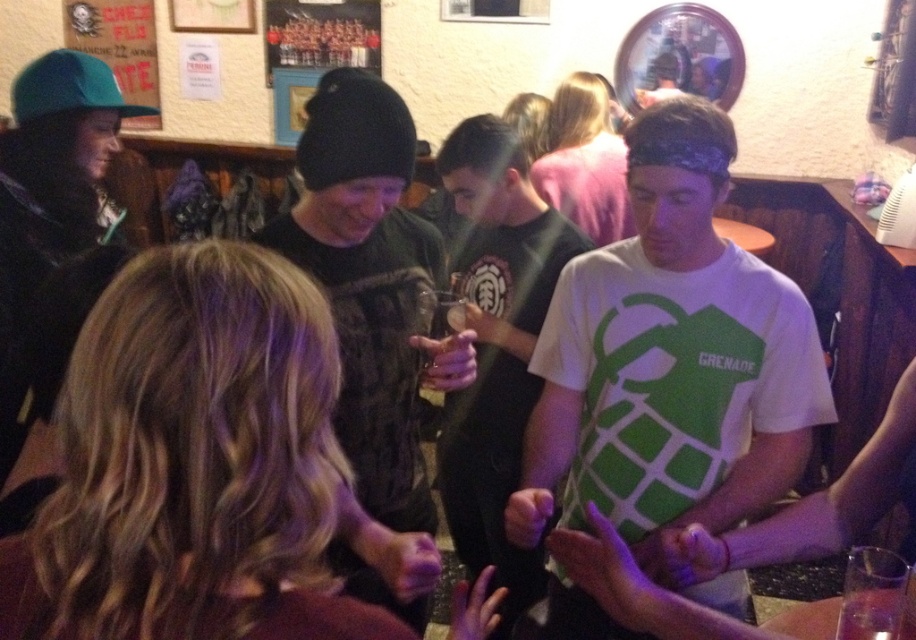
You are standing in the bar and want to take a photo of both the person in the white t shirt with green grenade graphic and the individual in black. The person in white is at point (407, 244) and the individual in black is at point (871, 637). Which person should you focus on first to ensure both are in focus?

You should focus on the person at point (407, 244) first because they are closer to the camera than the individual at point (871, 637). This ensures the foreground subject is in focus while the background subject remains sharp enough in the depth of field.

You are at the bar and want to reach the exit located at point (x=886, y=616). There is an obstacle at point (x=555, y=269). Can you walk directly to the exit without going around the obstacle?

Point (x=555, y=269) is behind point (x=886, y=616), so you can walk directly to the exit at point (x=886, y=616) without needing to go around the obstacle at point (x=555, y=269).